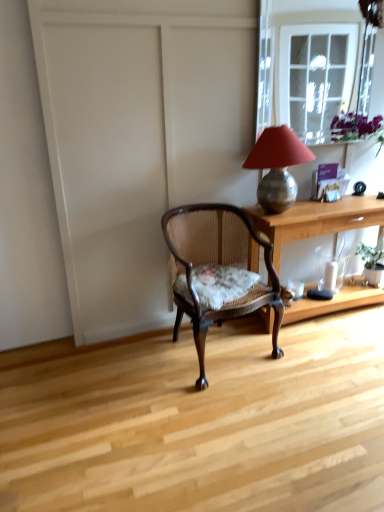
The image size is (384, 512). I want to click on vacant location below wooden cane chair with floral cushion at center (from a real-world perspective), so click(x=222, y=352).